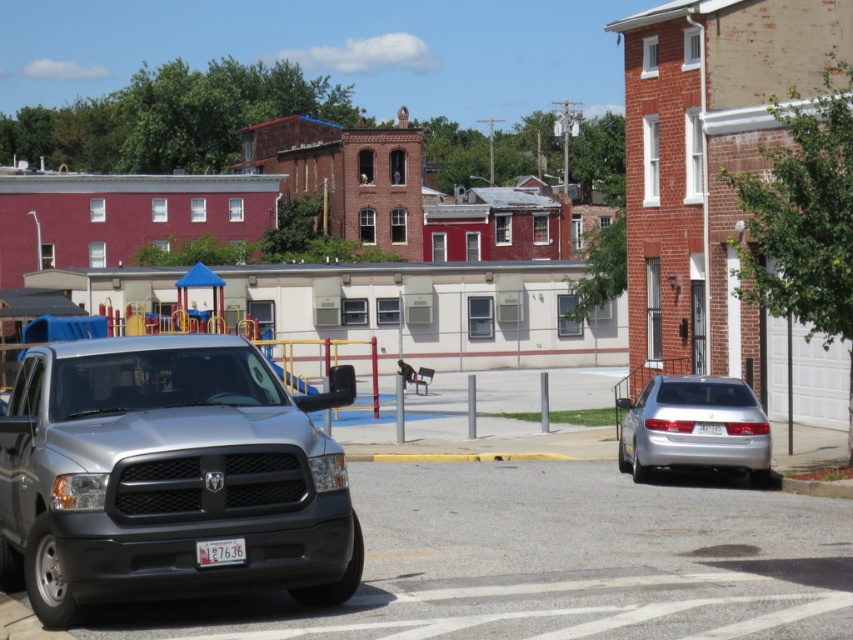
Is matte gray truck at lower left shorter than silver metallic sedan at right?

No.

Can you confirm if matte gray truck at lower left is positioned to the right of silver metallic sedan at right?

In fact, matte gray truck at lower left is to the left of silver metallic sedan at right.

Where is `matte gray truck at lower left`? matte gray truck at lower left is located at coordinates pyautogui.click(x=169, y=477).